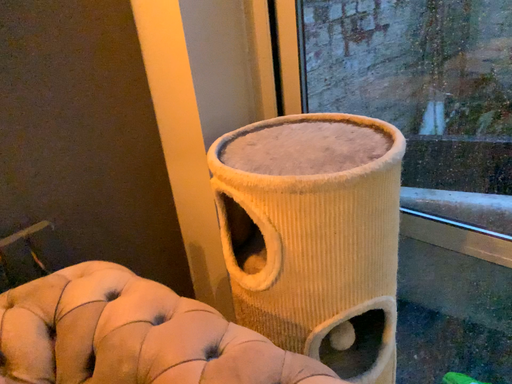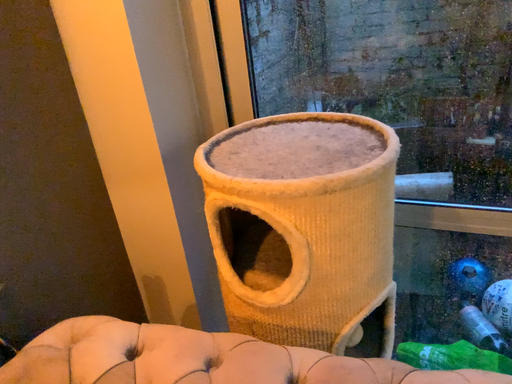
Question: Which way did the camera rotate in the video?

Choices:
 (A) rotated right
 (B) rotated left

Answer: (A)